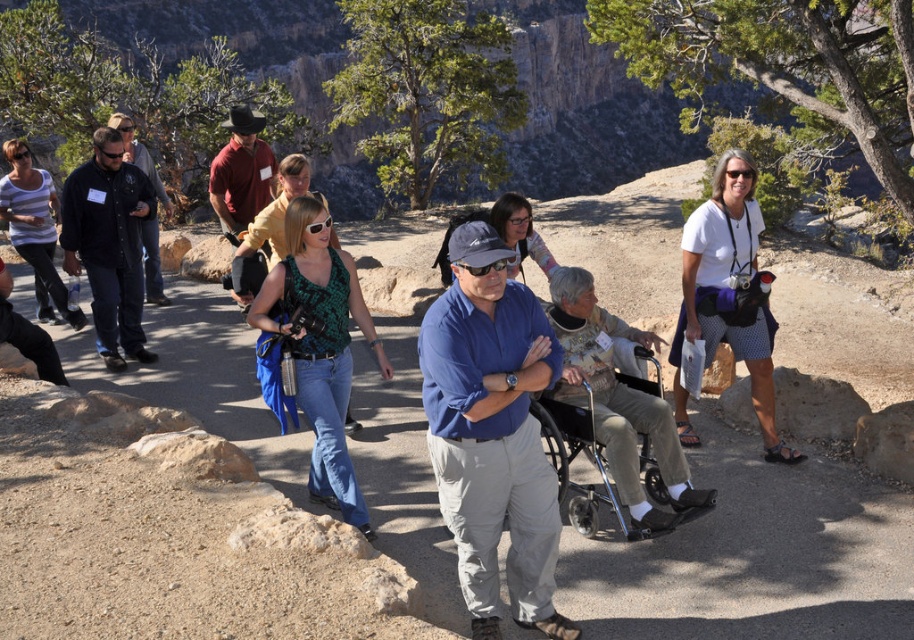
Question: Is black cotton shirt at center bigger than black shirt at center?

Choices:
 (A) no
 (B) yes

Answer: (B)

Question: Which point is farther to the camera?

Choices:
 (A) dirt path at center
 (B) blue cotton shirt at center
 (C) black shirt at center
 (D) reddish-brown leather jacket at center

Answer: (C)

Question: Estimate the real-world distances between objects in this image. Which object is closer to the metallic silver wheelchair at center?

Choices:
 (A) reddish-brown leather jacket at center
 (B) white cotton shirt at center
 (C) black shirt at center
 (D) dirt path at center

Answer: (B)

Question: Which point appears closest to the camera in this image?

Choices:
 (A) (428, 369)
 (B) (126, 129)
 (C) (408, 396)
 (D) (112, 188)

Answer: (A)

Question: Can you confirm if black cotton shirt at center is positioned below reddish-brown leather jacket at center?

Choices:
 (A) no
 (B) yes

Answer: (B)

Question: Does white cotton shirt at center have a larger size compared to metallic silver wheelchair at center?

Choices:
 (A) yes
 (B) no

Answer: (A)